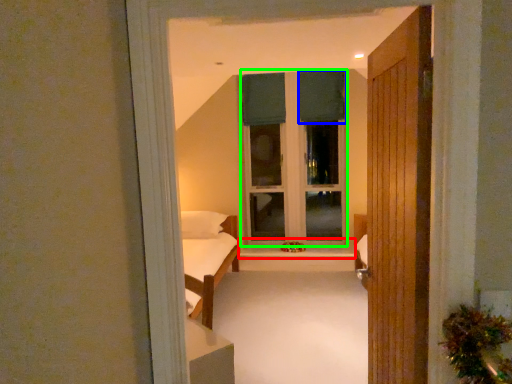
Question: Based on their relative distances, which object is farther from window sill (highlighted by a red box)? Choose from curtain (highlighted by a blue box) and window frame (highlighted by a green box).

Choices:
 (A) curtain
 (B) window frame

Answer: (A)